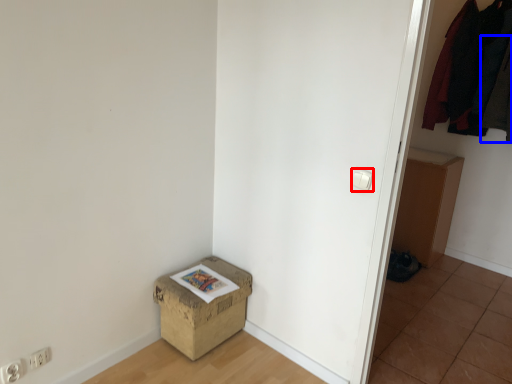
Question: Among these objects, which one is farthest to the camera, light switch (highlighted by a red box) or clothing (highlighted by a blue box)?

Choices:
 (A) light switch
 (B) clothing

Answer: (B)